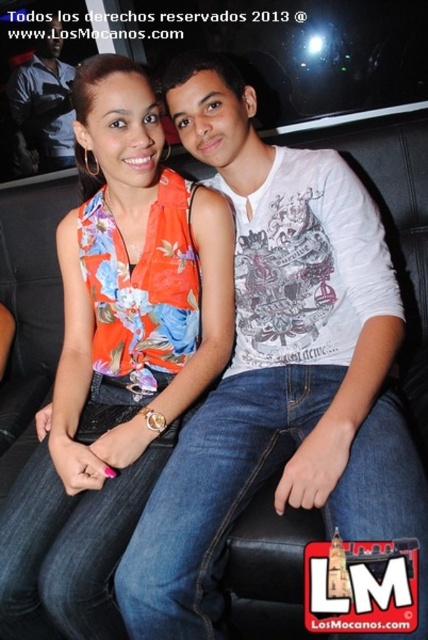
Looking at this image, you are standing in a dimly lit lounge and see a black leather couch with two people sitting close together. There is a specific point marked at coordinates point (175,102). If you want to place a small table exactly at that point, will it be within reach of both individuals on the couch?

The distance between point (175,102) and the viewer is 1.14 meters. Since the table is placed at that point, it would be 1.14 meters away from where you are standing. However, the reach of the individuals on the couch depends on their arm length and posture. Assuming average arm reach of about 1 meter, the table might be slightly out of reach for both individuals as 1.14 meters exceeds the typical reach distance.